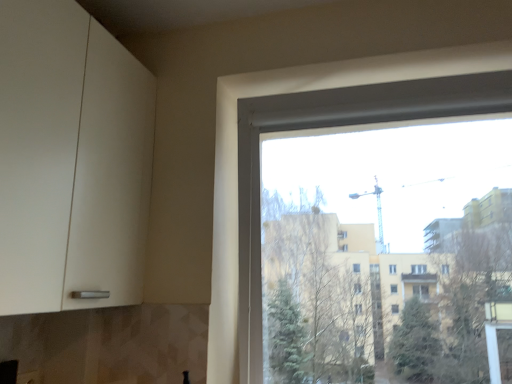
Measure the distance between transparent glass window at right and camera.

4.63 feet.

This screenshot has width=512, height=384. What do you see at coordinates (333, 126) in the screenshot? I see `transparent glass window at right` at bounding box center [333, 126].

I want to click on transparent glass window at right, so click(x=333, y=126).

You are a GUI agent. You are given a task and a screenshot of the screen. Output one action in this format:
    pyautogui.click(x=<x>, y=<y>)
    Task: Click on the transparent glass window at right
    This screenshot has width=512, height=384.
    Given the screenshot: What is the action you would take?
    pyautogui.click(x=333, y=126)